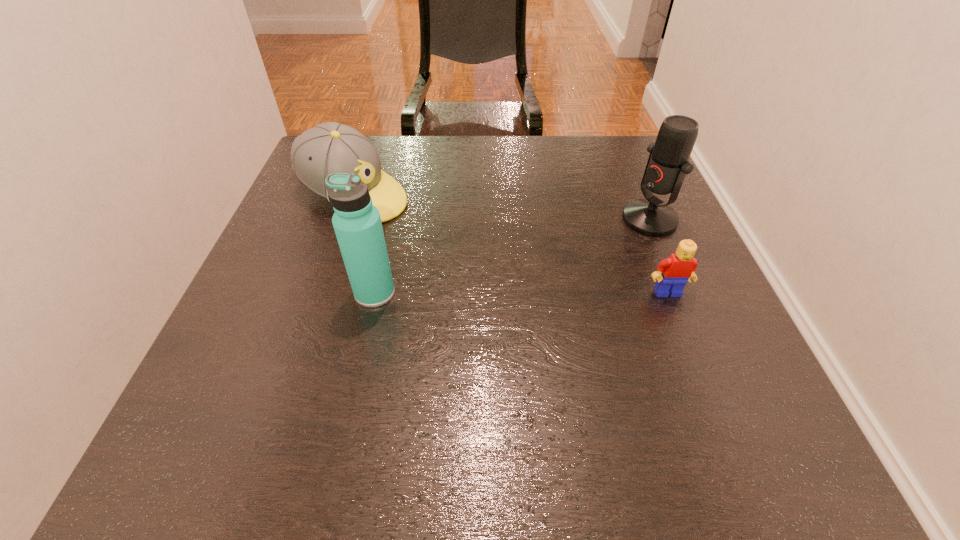
In the image, there is a desktop. In order to click on free space at the right edge in this screenshot , I will do `click(642, 321)`.

Find the location of `free location at the far right corner`. free location at the far right corner is located at coordinates [x=622, y=166].

At what (x,y) coordinates should I click in order to perform the action: click on vacant position at the near right corner of the desktop. Please return your answer as a coordinate pair (x, y). This screenshot has height=540, width=960. Looking at the image, I should click on (732, 364).

Find the location of a particular element. The image size is (960, 540). vacant area between the microphone and the third tallest object is located at coordinates [x=502, y=207].

The image size is (960, 540). What are the coordinates of `unoccupied area between the microphone and the third tallest object` in the screenshot? It's located at (502, 207).

Where is `free space between the microphone and the second shortest object`? The image size is (960, 540). free space between the microphone and the second shortest object is located at coordinates (502, 207).

What are the coordinates of `unoccupied position between the microphone and the third tallest object` in the screenshot? It's located at (502, 207).

Find the location of `free area in between the second shortest object and the Lego`. free area in between the second shortest object and the Lego is located at coordinates (511, 243).

This screenshot has width=960, height=540. In order to click on blank region between the baseball cap and the microphone in this screenshot , I will do `click(502, 207)`.

You are a GUI agent. You are given a task and a screenshot of the screen. Output one action in this format:
    pyautogui.click(x=<x>, y=<y>)
    Task: Click on the free spot between the shortest object and the microphone
    
    Given the screenshot: What is the action you would take?
    pyautogui.click(x=659, y=256)